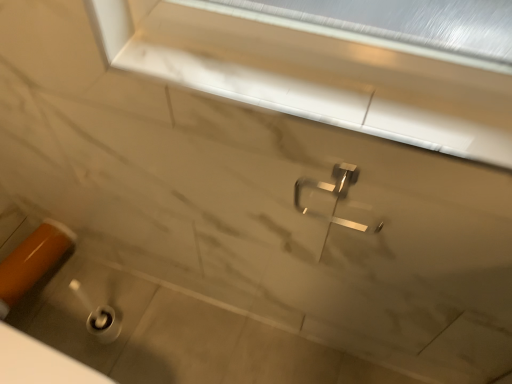
What do you see at coordinates (334, 195) in the screenshot?
I see `polished metallic tap at center` at bounding box center [334, 195].

What is the approximate width of white marble window frame at upper center?

white marble window frame at upper center is 3.51 inches in width.

You are a GUI agent. You are given a task and a screenshot of the screen. Output one action in this format:
    pyautogui.click(x=<x>, y=<y>)
    Task: Click on the orange glossy door handle at lower left
    
    Given the screenshot: What is the action you would take?
    pyautogui.click(x=32, y=261)

Between polished metallic tap at center and white marble window frame at upper center, which one is positioned behind?

polished metallic tap at center is further from the camera.

Looking at this image, can you confirm if polished metallic tap at center is taller than white marble window frame at upper center?

Yes.

From the image's perspective, between polished metallic tap at center and white marble window frame at upper center, which one is located above?

white marble window frame at upper center, from the image's perspective.

Is polished metallic tap at center with white marble window frame at upper center?

No.

Is polished metallic tap at center aimed at orange glossy door handle at lower left?

No.

Considering the positions of objects polished metallic tap at center and orange glossy door handle at lower left in the image provided, who is more to the right, polished metallic tap at center or orange glossy door handle at lower left?

From the viewer's perspective, polished metallic tap at center appears more on the right side.

Can you confirm if polished metallic tap at center is thinner than orange glossy door handle at lower left?

Indeed, polished metallic tap at center has a lesser width compared to orange glossy door handle at lower left.

Considering the relative sizes of polished metallic tap at center and orange glossy door handle at lower left in the image provided, is polished metallic tap at center shorter than orange glossy door handle at lower left?

Incorrect, the height of polished metallic tap at center does not fall short of that of orange glossy door handle at lower left.

Looking at this image, are white marble window frame at upper center and orange glossy door handle at lower left located far from each other?

No, white marble window frame at upper center is not far away from orange glossy door handle at lower left.

Between white marble window frame at upper center and orange glossy door handle at lower left, which one has less height?

With less height is white marble window frame at upper center.

From the image's perspective, which is above, white marble window frame at upper center or orange glossy door handle at lower left?

white marble window frame at upper center is shown above in the image.

Find the location of a particular element. This screenshot has height=384, width=512. door handle on the left of the white marble window frame at upper center is located at coordinates point(32,261).

Does orange glossy door handle at lower left have a greater width compared to polished metallic tap at center?

Correct, the width of orange glossy door handle at lower left exceeds that of polished metallic tap at center.

Can you confirm if orange glossy door handle at lower left is bigger than polished metallic tap at center?

Indeed, orange glossy door handle at lower left has a larger size compared to polished metallic tap at center.

Considering the sizes of white marble window frame at upper center and polished metallic tap at center in the image, is white marble window frame at upper center bigger or smaller than polished metallic tap at center?

white marble window frame at upper center is bigger than polished metallic tap at center.

From a real-world perspective, is white marble window frame at upper center above or below polished metallic tap at center?

From a real-world perspective, white marble window frame at upper center is physically above polished metallic tap at center.

Considering the sizes of objects white marble window frame at upper center and polished metallic tap at center in the image provided, who is wider, white marble window frame at upper center or polished metallic tap at center?

white marble window frame at upper center.

Which of these two, white marble window frame at upper center or polished metallic tap at center, stands taller?

polished metallic tap at center.

From the picture: From the image's perspective, which object appears higher, orange glossy door handle at lower left or white marble window frame at upper center?

white marble window frame at upper center.

Can you confirm if orange glossy door handle at lower left is thinner than white marble window frame at upper center?

Indeed, orange glossy door handle at lower left has a lesser width compared to white marble window frame at upper center.

Where is `door handle behind the white marble window frame at upper center`? This screenshot has height=384, width=512. door handle behind the white marble window frame at upper center is located at coordinates (32, 261).

Is orange glossy door handle at lower left positioned far away from white marble window frame at upper center?

No, orange glossy door handle at lower left is not far from white marble window frame at upper center.

Find the location of `tap located below the white marble window frame at upper center (from the image's perspective)`. tap located below the white marble window frame at upper center (from the image's perspective) is located at coordinates (334, 195).

At what (x,y) coordinates should I click in order to perform the action: click on tap lying above the orange glossy door handle at lower left (from the image's perspective). Please return your answer as a coordinate pair (x, y). The width and height of the screenshot is (512, 384). Looking at the image, I should click on (334, 195).

Based on their spatial positions, is polished metallic tap at center or white marble window frame at upper center further from orange glossy door handle at lower left?

white marble window frame at upper center lies further to orange glossy door handle at lower left than the other object.

Estimate the real-world distances between objects in this image. Which object is closer to polished metallic tap at center, orange glossy door handle at lower left or white marble window frame at upper center?

Among the two, white marble window frame at upper center is located nearer to polished metallic tap at center.

From the image, which object appears to be nearer to white marble window frame at upper center, polished metallic tap at center or orange glossy door handle at lower left?

Among the two, polished metallic tap at center is located nearer to white marble window frame at upper center.

Estimate the real-world distances between objects in this image. Which object is closer to orange glossy door handle at lower left, white marble window frame at upper center or polished metallic tap at center?

polished metallic tap at center is positioned closer to the anchor orange glossy door handle at lower left.

Estimate the real-world distances between objects in this image. Which object is closer to white marble window frame at upper center, orange glossy door handle at lower left or polished metallic tap at center?

Among the two, polished metallic tap at center is located nearer to white marble window frame at upper center.

Based on their spatial positions, is white marble window frame at upper center or orange glossy door handle at lower left further from polished metallic tap at center?

orange glossy door handle at lower left is positioned further to the anchor polished metallic tap at center.

Locate an element on the screen. The image size is (512, 384). window frame between orange glossy door handle at lower left and polished metallic tap at center from left to right is located at coordinates (316, 73).